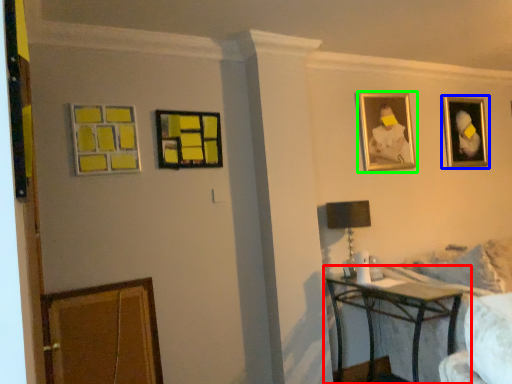
Question: Based on their relative distances, which object is farther from table (highlighted by a red box)? Choose from picture frame (highlighted by a blue box) and picture frame (highlighted by a green box).

Choices:
 (A) picture frame
 (B) picture frame

Answer: (A)